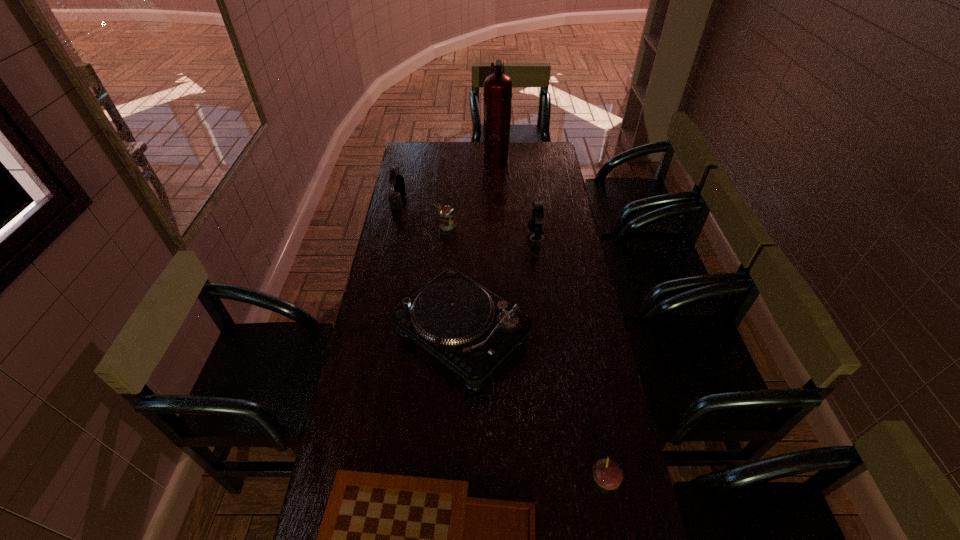
Where is `blank area located on the headband of the headset`? blank area located on the headband of the headset is located at coordinates pos(436,200).

At what (x,y) coordinates should I click in order to perform the action: click on free space located 0.400m on the ear cups of the sixth object from left to right. Please return your answer as a coordinate pair (x, y). Image resolution: width=960 pixels, height=540 pixels. Looking at the image, I should click on (435, 237).

I want to click on free spot located on the ear cups of the sixth object from left to right, so click(x=497, y=237).

This screenshot has width=960, height=540. Identify the location of vacant region located on the ear cups of the sixth object from left to right. (514, 237).

At what (x,y) coordinates should I click in order to perform the action: click on vacant space positioned on the right of the third nearest object. Please return your answer as a coordinate pair (x, y). Looking at the image, I should click on (575, 333).

Locate an element on the screen. Image resolution: width=960 pixels, height=540 pixels. vacant space situated 0.250m on the right of the can is located at coordinates (515, 226).

I want to click on free location located on the left of the cupcake, so click(466, 480).

Image resolution: width=960 pixels, height=540 pixels. Find the location of `object located at the far edge`. object located at the far edge is located at coordinates (497, 93).

In order to click on headset present at the left edge in this screenshot , I will do `click(395, 202)`.

This screenshot has width=960, height=540. What are the coordinates of `record player that is at the left edge` in the screenshot? It's located at (471, 330).